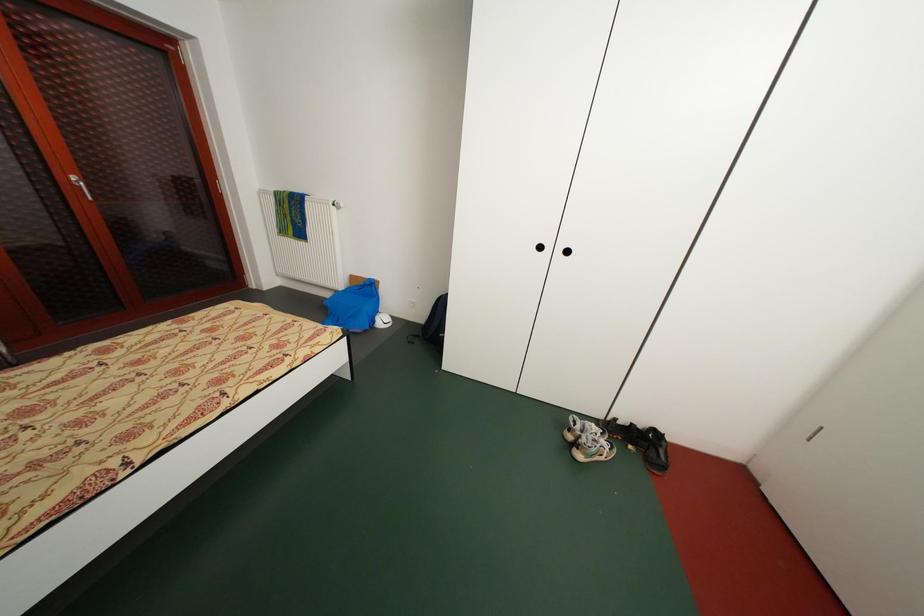
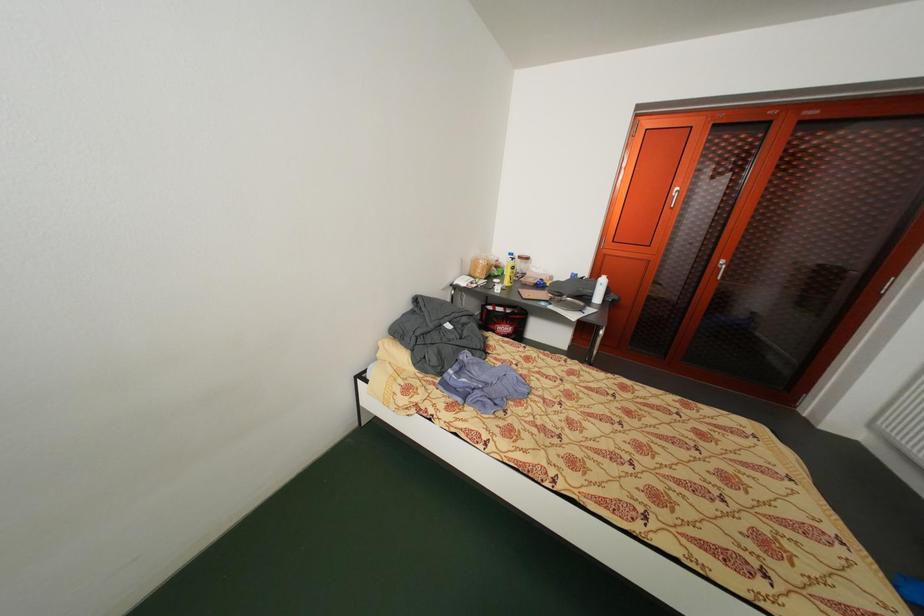
How did the camera likely rotate?

The camera rotated toward left-down.